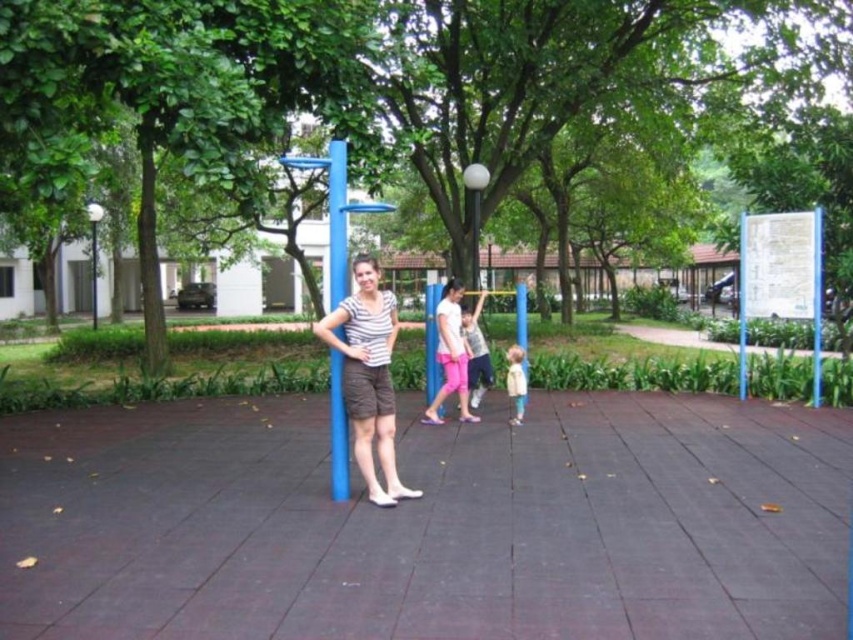
Question: Among these objects, which one is nearest to the camera?

Choices:
 (A) pink fabric pants at center
 (B) striped fabric shirt at center
 (C) light beige fabric jacket at lower right

Answer: (B)

Question: In this image, where is blue metallic pole at center located relative to light beige fabric jacket at lower right?

Choices:
 (A) right
 (B) left

Answer: (B)

Question: Estimate the real-world distances between objects in this image. Which object is farther from the pink fabric pants at center?

Choices:
 (A) blue metallic pole at center
 (B) light beige fabric jacket at lower right
 (C) striped fabric shirt at center

Answer: (C)

Question: In this image, where is blue metallic pole at center located relative to pink fabric pants at center?

Choices:
 (A) below
 (B) above

Answer: (B)

Question: Which is nearer to the striped fabric shirt at center?

Choices:
 (A) blue metallic pole at center
 (B) pink fabric pants at center

Answer: (A)

Question: Is pink fabric pants at center positioned at the back of light brown fabric shirt at center?

Choices:
 (A) no
 (B) yes

Answer: (A)